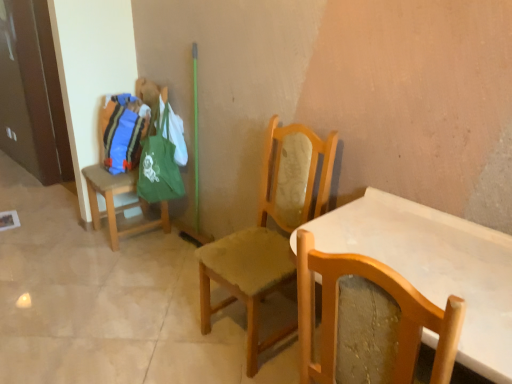
I want to click on free region under wooden chair at center, arranged as the 2th chair when viewed from the right (from a real-world perspective), so click(244, 330).